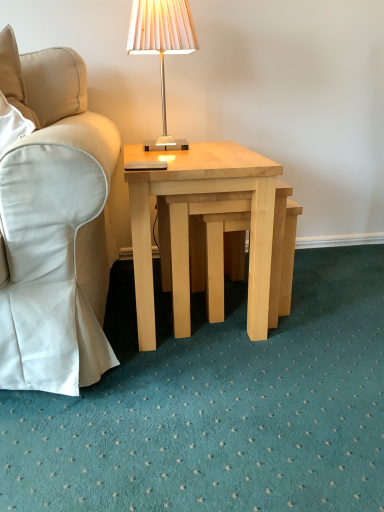
Describe the element at coordinates (200, 193) in the screenshot. I see `light wood/natural wood coffee table at center` at that location.

This screenshot has height=512, width=384. In order to click on light wood step stool at center in this screenshot , I will do `click(203, 249)`.

Measure the distance between point (210,217) and camera.

Point (210,217) and camera are 4.03 feet apart.

The image size is (384, 512). Describe the element at coordinates (54, 226) in the screenshot. I see `beige fabric chair at left` at that location.

The height and width of the screenshot is (512, 384). What do you see at coordinates (162, 47) in the screenshot?
I see `matte white lampshade at upper center` at bounding box center [162, 47].

You are a GUI agent. You are given a task and a screenshot of the screen. Output one action in this format:
    pyautogui.click(x=<x>, y=<y>)
    Task: Click on the light wood/natural wood coffee table at center
    
    Given the screenshot: What is the action you would take?
    pyautogui.click(x=200, y=193)

Which of these two, beige fabric chair at left or matte white lampshade at upper center, is bigger?

beige fabric chair at left is bigger.

Considering the positions of objects beige fabric chair at left and matte white lampshade at upper center in the image provided, who is more to the left, beige fabric chair at left or matte white lampshade at upper center?

Positioned to the left is beige fabric chair at left.

From the image's perspective, between beige fabric chair at left and matte white lampshade at upper center, which one is located above?

From the image's view, matte white lampshade at upper center is above.

Is beige fabric chair at left shorter than light wood/natural wood coffee table at center?

No, beige fabric chair at left is not shorter than light wood/natural wood coffee table at center.

Between beige fabric chair at left and light wood/natural wood coffee table at center, which one has smaller size?

With smaller size is beige fabric chair at left.

Based on the photo, which object is further away from the camera, beige fabric chair at left or light wood/natural wood coffee table at center?

Positioned behind is light wood/natural wood coffee table at center.

Does point (210, 262) come closer to viewer compared to point (162, 138)?

Yes, point (210, 262) is in front of point (162, 138).

Who is bigger, light wood step stool at center or matte white lampshade at upper center?

light wood step stool at center.

From a real-world perspective, does light wood step stool at center sit lower than matte white lampshade at upper center?

Correct, in the physical world, light wood step stool at center is lower than matte white lampshade at upper center.

Which object is closer to the camera, light wood step stool at center or matte white lampshade at upper center?

light wood step stool at center.

Is point (20, 383) behind point (295, 227)?

No, (20, 383) is closer to viewer.

Based on their sizes in the image, would you say beige fabric chair at left is bigger or smaller than light wood step stool at center?

In the image, beige fabric chair at left appears to be smaller than light wood step stool at center.

From the image's perspective, is beige fabric chair at left on light wood step stool at center?

Yes, from the image's perspective, beige fabric chair at left is above light wood step stool at center.

Is beige fabric chair at left positioned beyond the bounds of light wood step stool at center?

Absolutely, beige fabric chair at left is external to light wood step stool at center.

Does light wood step stool at center appear on the right side of beige fabric chair at left?

Indeed, light wood step stool at center is positioned on the right side of beige fabric chair at left.

From a real-world perspective, is light wood step stool at center positioned under beige fabric chair at left based on gravity?

Yes, from a real-world perspective, light wood step stool at center is below beige fabric chair at left.

Which is in front, point (271, 302) or point (25, 182)?

Positioned in front is point (25, 182).

In terms of width, does light wood step stool at center look wider or thinner when compared to beige fabric chair at left?

In the image, light wood step stool at center appears to be wider than beige fabric chair at left.

From a real-world perspective, is light wood step stool at center physically located above or below light wood/natural wood coffee table at center?

Clearly, from a real-world perspective, light wood step stool at center is below light wood/natural wood coffee table at center.

Between light wood step stool at center and light wood/natural wood coffee table at center, which one appears on the right side from the viewer's perspective?

light wood step stool at center is more to the right.

From the picture: Is light wood step stool at center bigger than light wood/natural wood coffee table at center?

No, light wood step stool at center is not bigger than light wood/natural wood coffee table at center.

What's the angular difference between light wood step stool at center and light wood/natural wood coffee table at center's facing directions?

1.63 degrees.

How many degrees apart are the facing directions of matte white lampshade at upper center and light wood step stool at center?

matte white lampshade at upper center and light wood step stool at center are facing 1.63 degrees away from each other.

Is matte white lampshade at upper center oriented away from light wood step stool at center?

No, matte white lampshade at upper center's orientation is not away from light wood step stool at center.

Is point (178, 51) closer or farther from the camera than point (173, 221)?

Point (178, 51) appears to be farther away from the viewer than point (173, 221).

At what (x,y) coordinates should I click in order to perform the action: click on lamp on the left of the light wood step stool at center. Please return your answer as a coordinate pair (x, y). Looking at the image, I should click on (162, 47).

This screenshot has width=384, height=512. I want to click on lamp behind the beige fabric chair at left, so click(162, 47).

This screenshot has width=384, height=512. What are the coordinates of `chair located above the light wood/natural wood coffee table at center (from a real-world perspective)` in the screenshot? It's located at (54, 226).

Considering their positions, is beige fabric chair at left positioned further to matte white lampshade at upper center than light wood step stool at center?

light wood step stool at center is further to matte white lampshade at upper center.

Considering their positions, is light wood step stool at center positioned closer to light wood/natural wood coffee table at center than matte white lampshade at upper center?

light wood step stool at center is closer to light wood/natural wood coffee table at center.

Considering their positions, is matte white lampshade at upper center positioned closer to light wood step stool at center than light wood/natural wood coffee table at center?

light wood/natural wood coffee table at center.

Looking at the image, which one is located closer to beige fabric chair at left, matte white lampshade at upper center or light wood/natural wood coffee table at center?

light wood/natural wood coffee table at center is closer to beige fabric chair at left.

Considering their positions, is beige fabric chair at left positioned closer to matte white lampshade at upper center than light wood/natural wood coffee table at center?

light wood/natural wood coffee table at center is closer to matte white lampshade at upper center.

Consider the image. When comparing their distances from matte white lampshade at upper center, does light wood/natural wood coffee table at center or beige fabric chair at left seem further?

beige fabric chair at left is further to matte white lampshade at upper center.

Based on their spatial positions, is light wood/natural wood coffee table at center or matte white lampshade at upper center closer to beige fabric chair at left?

The object closer to beige fabric chair at left is light wood/natural wood coffee table at center.

Which object lies further to the anchor point light wood/natural wood coffee table at center, beige fabric chair at left or matte white lampshade at upper center?

matte white lampshade at upper center is further to light wood/natural wood coffee table at center.

This screenshot has width=384, height=512. Find the location of `lamp between beige fabric chair at left and light wood/natural wood coffee table at center from left to right`. lamp between beige fabric chair at left and light wood/natural wood coffee table at center from left to right is located at coordinates (162, 47).

You are a GUI agent. You are given a task and a screenshot of the screen. Output one action in this format:
    pyautogui.click(x=<x>, y=<y>)
    Task: Click on the coffee table between beige fabric chair at left and light wood step stool at center in the horizontal direction
    The width and height of the screenshot is (384, 512).
    Given the screenshot: What is the action you would take?
    pyautogui.click(x=200, y=193)

The height and width of the screenshot is (512, 384). I want to click on coffee table between matte white lampshade at upper center and light wood step stool at center in the up-down direction, so click(x=200, y=193).

Where is `lamp between beige fabric chair at left and light wood step stool at center`? lamp between beige fabric chair at left and light wood step stool at center is located at coordinates (162, 47).